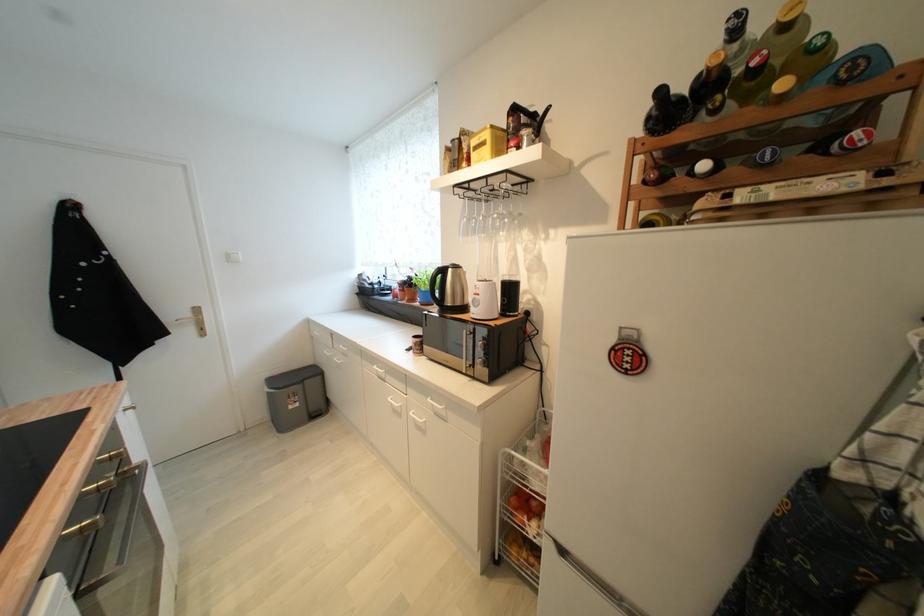
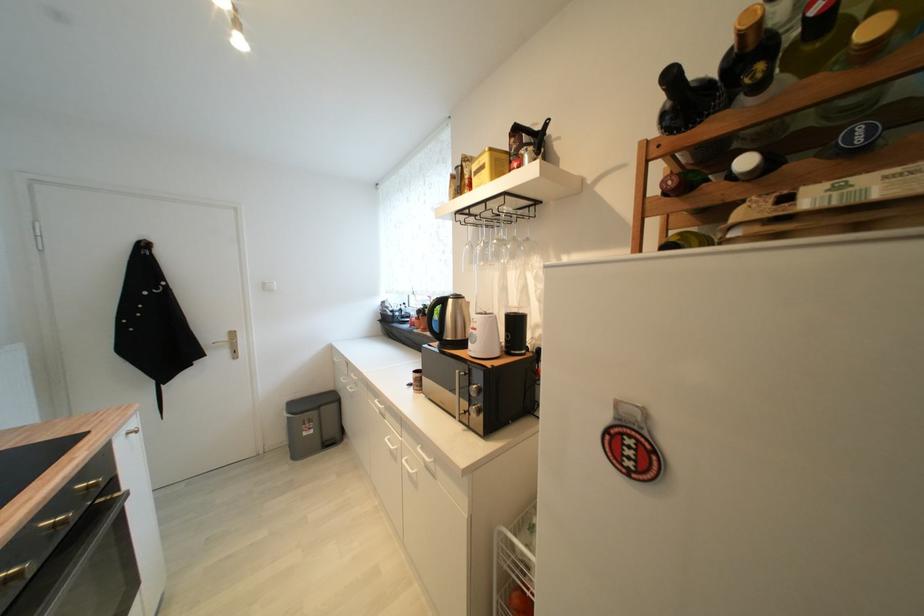
Question: The first image is from the beginning of the video and the second image is from the end. How did the camera likely rotate when shooting the video?

Choices:
 (A) Left
 (B) Right
 (C) Up
 (D) Down

Answer: (A)